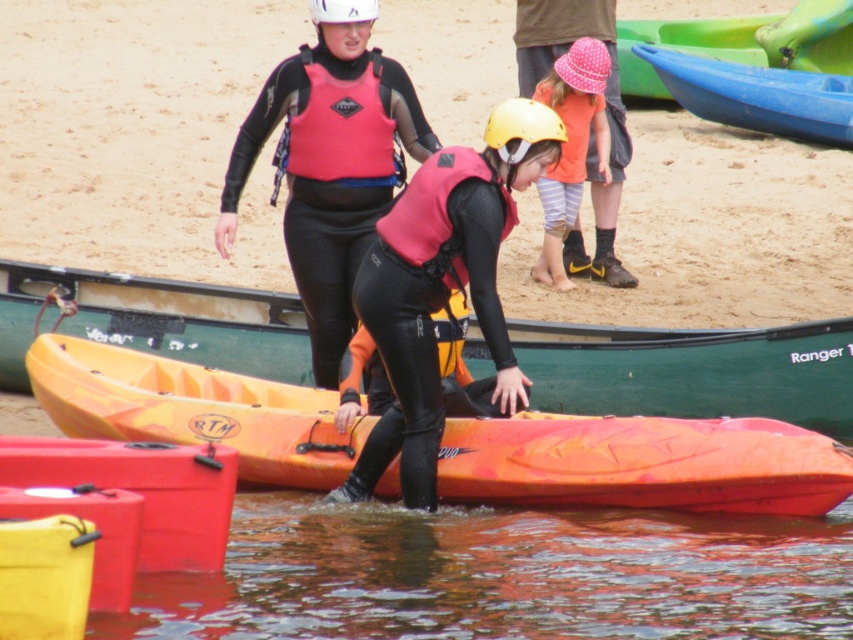
You are standing at the point labeled point (405, 348) and want to walk to the point labeled point (317, 4). Which direction should you face to walk towards the destination?

You should face towards the point (317, 4), which is farther from the viewer compared to point (405, 348). Since point (317, 4) is located at a lower coordinate in the y axis, you should face downward to walk towards it.

You are a drone operator trying to capture a photo of the person in the kayak from above. The drone is currently at the point where the brown murky water at lower center is located. To avoid crashing into the kayak, you need to move the drone to a safe position. Which direction should you move the drone to get away from the kayak?

The brown murky water at lower center is located at point (502, 576). To move away from the kayak, you should move the drone in the direction opposite to where the kayak is positioned relative to this point.